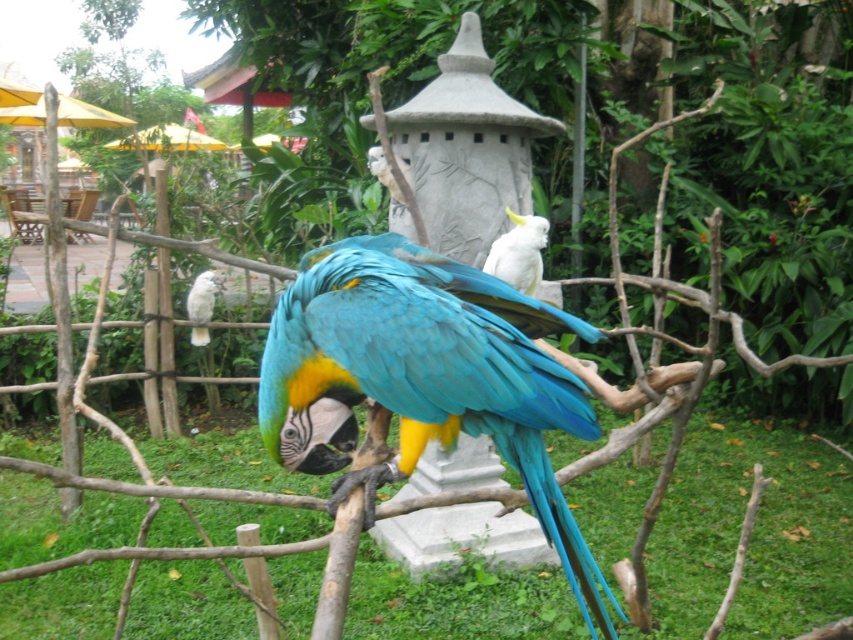
Can you confirm if blue glossy parrot at center is positioned to the right of white matte parrot at center?

Incorrect, blue glossy parrot at center is not on the right side of white matte parrot at center.

Does blue glossy parrot at center appear over white matte parrot at center?

Actually, blue glossy parrot at center is below white matte parrot at center.

Where is `blue glossy parrot at center`? The height and width of the screenshot is (640, 853). blue glossy parrot at center is located at coordinates (424, 378).

Is white matte parrot at center bigger than white feathered parrot at center?

Indeed, white matte parrot at center has a larger size compared to white feathered parrot at center.

Is white matte parrot at center to the right of white feathered parrot at center from the viewer's perspective?

Correct, you'll find white matte parrot at center to the right of white feathered parrot at center.

Which is behind, point (514, 225) or point (195, 284)?

The point (195, 284) is behind.

The width and height of the screenshot is (853, 640). In order to click on white matte parrot at center in this screenshot , I will do `click(519, 252)`.

The image size is (853, 640). Describe the element at coordinates (424, 378) in the screenshot. I see `blue glossy parrot at center` at that location.

This screenshot has height=640, width=853. I want to click on blue glossy parrot at center, so click(x=424, y=378).

Locate an element on the screen. blue glossy parrot at center is located at coordinates (424, 378).